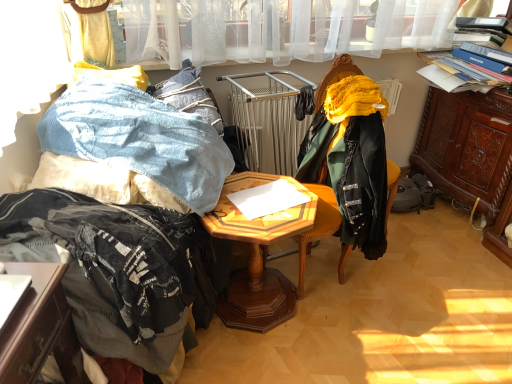
This screenshot has width=512, height=384. I want to click on brown carved wood cabinet at right, so click(470, 155).

The width and height of the screenshot is (512, 384). What do you see at coordinates (139, 138) in the screenshot?
I see `denim fabric at left` at bounding box center [139, 138].

What do you see at coordinates (347, 165) in the screenshot? I see `velvet green chair at center` at bounding box center [347, 165].

Locate an element on the screen. fuzzy black blanket at left is located at coordinates (136, 155).

What is the approximate width of woodenobject at center?

woodenobject at center is 20.51 inches in width.

At what (x,y) coordinates should I click in order to perform the action: click on brown carved wood cabinet at right. Please return your answer as a coordinate pair (x, y). Looking at the image, I should click on (470, 155).

Based on the photo, between brown carved wood cabinet at right and fuzzy black blanket at left, which one appears on the right side from the viewer's perspective?

Positioned to the right is brown carved wood cabinet at right.

Considering the sizes of brown carved wood cabinet at right and fuzzy black blanket at left in the image, is brown carved wood cabinet at right taller or shorter than fuzzy black blanket at left?

Clearly, brown carved wood cabinet at right is taller compared to fuzzy black blanket at left.

Consider the image. Does brown carved wood cabinet at right come in front of fuzzy black blanket at left?

No, brown carved wood cabinet at right is behind fuzzy black blanket at left.

Is brown carved wood cabinet at right smaller than fuzzy black blanket at left?

No, brown carved wood cabinet at right is not smaller than fuzzy black blanket at left.

Does denim fabric at left appear on the left side of woodenobject at center?

Indeed, denim fabric at left is positioned on the left side of woodenobject at center.

Is denim fabric at left oriented away from woodenobject at center?

No.

In the scene shown: Is denim fabric at left thinner than woodenobject at center?

Incorrect, the width of denim fabric at left is not less than that of woodenobject at center.

Is denim fabric at left directly adjacent to woodenobject at center?

No, denim fabric at left is not touching woodenobject at center.

Which object is positioned more to the right, brown carved wood cabinet at right or velvet green chair at center?

From the viewer's perspective, brown carved wood cabinet at right appears more on the right side.

Is brown carved wood cabinet at right in front of or behind velvet green chair at center in the image?

Clearly, brown carved wood cabinet at right is behind velvet green chair at center.

Is brown carved wood cabinet at right not within velvet green chair at center?

brown carved wood cabinet at right is positioned outside velvet green chair at center.

Looking at this image, is velvet green chair at center aimed at fuzzy black blanket at left?

Yes, velvet green chair at center is aimed at fuzzy black blanket at left.

From the image's perspective, which object appears higher, velvet green chair at center or fuzzy black blanket at left?

velvet green chair at center.

From the picture: In the image, is velvet green chair at center positioned in front of or behind fuzzy black blanket at left?

In the image, velvet green chair at center appears behind fuzzy black blanket at left.

Is point (390, 189) less distant than point (144, 132)?

No.

Can velvet green chair at center be found inside woodenobject at center?

No, velvet green chair at center is located outside of woodenobject at center.

Where is `chair in front of the woodenobject at center`? The height and width of the screenshot is (384, 512). chair in front of the woodenobject at center is located at coordinates (347, 165).

Is point (225, 312) more distant than point (321, 215)?

Yes, point (225, 312) is behind point (321, 215).

Is woodenobject at center aimed at velvet green chair at center?

No.

Is denim fabric at left bigger or smaller than fuzzy black blanket at left?

In the image, denim fabric at left appears to be larger than fuzzy black blanket at left.

Looking at this image, is denim fabric at left shorter than fuzzy black blanket at left?

Indeed, denim fabric at left has a lesser height compared to fuzzy black blanket at left.

From a real-world perspective, is denim fabric at left above or below fuzzy black blanket at left?

denim fabric at left is situated higher than fuzzy black blanket at left in the real world.

Is point (100, 186) positioned behind point (280, 320)?

No, (100, 186) is closer to viewer.

Can you confirm if fuzzy black blanket at left is shorter than woodenobject at center?

Indeed, fuzzy black blanket at left has a lesser height compared to woodenobject at center.

From the image's perspective, between fuzzy black blanket at left and woodenobject at center, who is located below?

woodenobject at center appears lower in the image.

From a real-world perspective, is fuzzy black blanket at left physically located above or below woodenobject at center?

fuzzy black blanket at left is above woodenobject at center.

Where is `bed that appears in front of the brown carved wood cabinet at right`? This screenshot has width=512, height=384. bed that appears in front of the brown carved wood cabinet at right is located at coordinates (136, 155).

This screenshot has height=384, width=512. I want to click on clothing on the left side of woodenobject at center, so click(139, 138).

Estimate the real-world distances between objects in this image. Which object is closer to fuzzy black blanket at left, brown carved wood cabinet at right or velvet green chair at center?

velvet green chair at center is closer to fuzzy black blanket at left.

Which object lies nearer to the anchor point woodenobject at center, brown carved wood cabinet at right or denim fabric at left?

Among the two, denim fabric at left is located nearer to woodenobject at center.

Which object lies further to the anchor point woodenobject at center, brown carved wood cabinet at right or fuzzy black blanket at left?

brown carved wood cabinet at right lies further to woodenobject at center than the other object.

When comparing their distances from velvet green chair at center, does fuzzy black blanket at left or woodenobject at center seem closer?

woodenobject at center lies closer to velvet green chair at center than the other object.

Looking at the image, which one is located closer to woodenobject at center, fuzzy black blanket at left or velvet green chair at center?

velvet green chair at center lies closer to woodenobject at center than the other object.

Looking at the image, which one is located closer to fuzzy black blanket at left, brown carved wood cabinet at right or woodenobject at center?

woodenobject at center lies closer to fuzzy black blanket at left than the other object.

Based on their spatial positions, is brown carved wood cabinet at right or velvet green chair at center closer to woodenobject at center?

Among the two, velvet green chair at center is located nearer to woodenobject at center.

When comparing their distances from brown carved wood cabinet at right, does denim fabric at left or woodenobject at center seem further?

denim fabric at left lies further to brown carved wood cabinet at right than the other object.

Find the location of a particular element. This screenshot has width=512, height=384. table situated between denim fabric at left and brown carved wood cabinet at right from left to right is located at coordinates (257, 255).

Locate an element on the screen. chair located between fuzzy black blanket at left and brown carved wood cabinet at right in the left-right direction is located at coordinates (347, 165).

Where is `chair between denim fabric at left and brown carved wood cabinet at right`? This screenshot has height=384, width=512. chair between denim fabric at left and brown carved wood cabinet at right is located at coordinates (347, 165).

At what (x,y) coordinates should I click in order to perform the action: click on clothing located between fuzzy black blanket at left and woodenobject at center in the left-right direction. Please return your answer as a coordinate pair (x, y). This screenshot has height=384, width=512. Looking at the image, I should click on (139, 138).